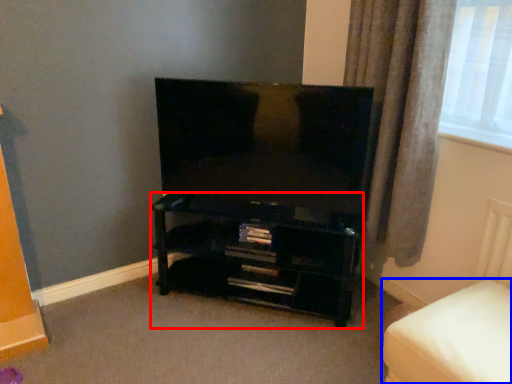
Question: Which point is further to the camera, shelf (highlighted by a red box) or furniture (highlighted by a blue box)?

Choices:
 (A) shelf
 (B) furniture

Answer: (A)